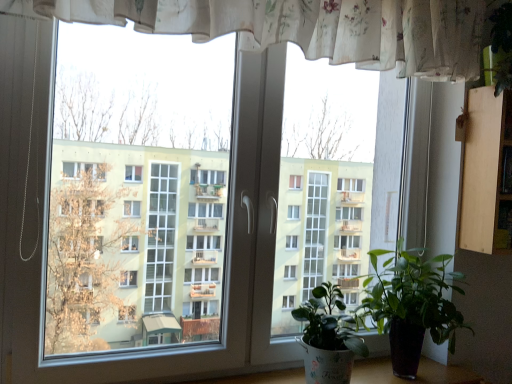
Question: In terms of height, does green glossy plant at lower right, placed as the second houseplant when sorted from left to right, look taller or shorter compared to green glossy leafy plant at lower right, which is the first houseplant from left to right?

Choices:
 (A) tall
 (B) short

Answer: (A)

Question: Is green glossy plant at lower right, which ranks as the first houseplant in right-to-left order, situated inside green glossy leafy plant at lower right, which is the second houseplant in right-to-left order, or outside?

Choices:
 (A) outside
 (B) inside

Answer: (A)

Question: Based on their positions, is green glossy plant at lower right, which ranks as the first houseplant in right-to-left order, located to the left or right of green glossy leafy plant at lower right, which is the second houseplant in right-to-left order?

Choices:
 (A) right
 (B) left

Answer: (A)

Question: From a real-world perspective, relative to green glossy plant at lower right, which ranks as the first houseplant in right-to-left order, is green glossy leafy plant at lower right, which is the first houseplant from left to right, vertically above or below?

Choices:
 (A) below
 (B) above

Answer: (A)

Question: Do you think green glossy leafy plant at lower right, which is the first houseplant from left to right, is within green glossy plant at lower right, placed as the second houseplant when sorted from left to right, or outside of it?

Choices:
 (A) outside
 (B) inside

Answer: (A)

Question: Considering the positions of green glossy leafy plant at lower right, which is the first houseplant from left to right, and green glossy plant at lower right, placed as the second houseplant when sorted from left to right, in the image, is green glossy leafy plant at lower right, which is the first houseplant from left to right, wider or thinner than green glossy plant at lower right, placed as the second houseplant when sorted from left to right,?

Choices:
 (A) thin
 (B) wide

Answer: (A)

Question: From the image's perspective, is green glossy leafy plant at lower right, which is the second houseplant in right-to-left order, above or below green glossy plant at lower right, which ranks as the first houseplant in right-to-left order?

Choices:
 (A) above
 (B) below

Answer: (B)